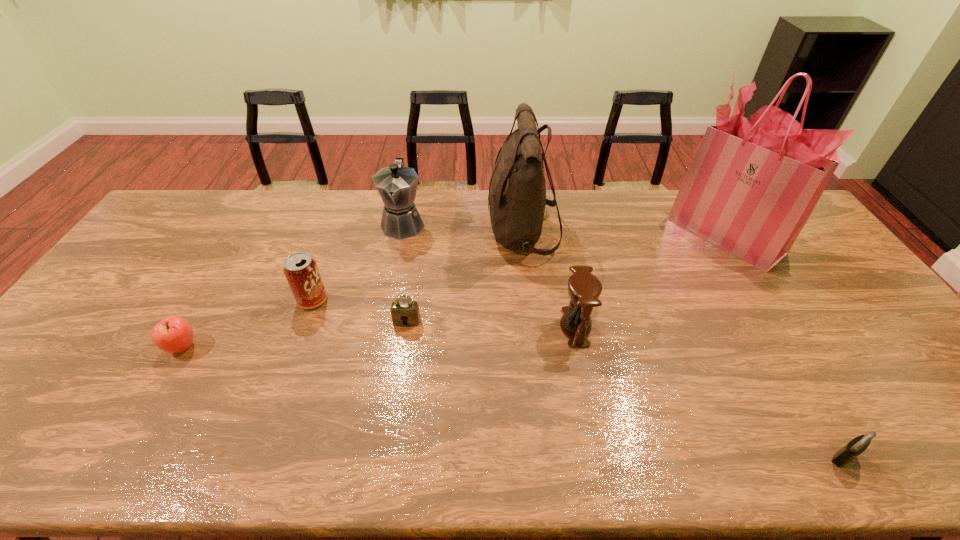
In order to click on the tallest object in this screenshot , I will do `click(751, 187)`.

I want to click on backpack, so click(x=517, y=191).

Where is `coffeepot`? The height and width of the screenshot is (540, 960). coffeepot is located at coordinates (397, 185).

Where is `hourglass`? This screenshot has height=540, width=960. hourglass is located at coordinates (584, 288).

Locate an element on the screen. The width and height of the screenshot is (960, 540). soda can is located at coordinates (300, 269).

Identify the location of the leftmost object. (172, 334).

This screenshot has width=960, height=540. What are the coordinates of `the left padlock` in the screenshot? It's located at 405,312.

This screenshot has width=960, height=540. Identify the location of the nearer padlock. (858, 445).

Locate an element on the screen. The image size is (960, 540). the right padlock is located at coordinates (858, 445).

Where is `vacant space situated on the left of the shopping bag`? This screenshot has height=540, width=960. vacant space situated on the left of the shopping bag is located at coordinates (559, 234).